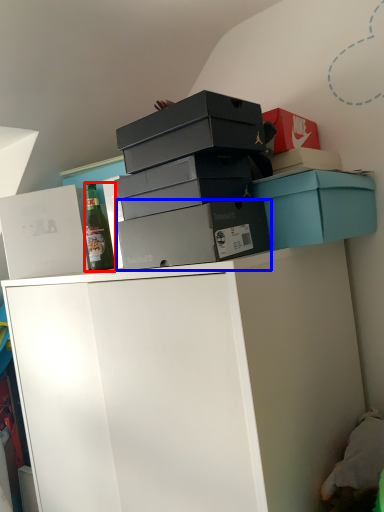
Question: Which object appears farthest to the camera in this image, bottle (highlighted by a red box) or box (highlighted by a blue box)?

Choices:
 (A) bottle
 (B) box

Answer: (A)